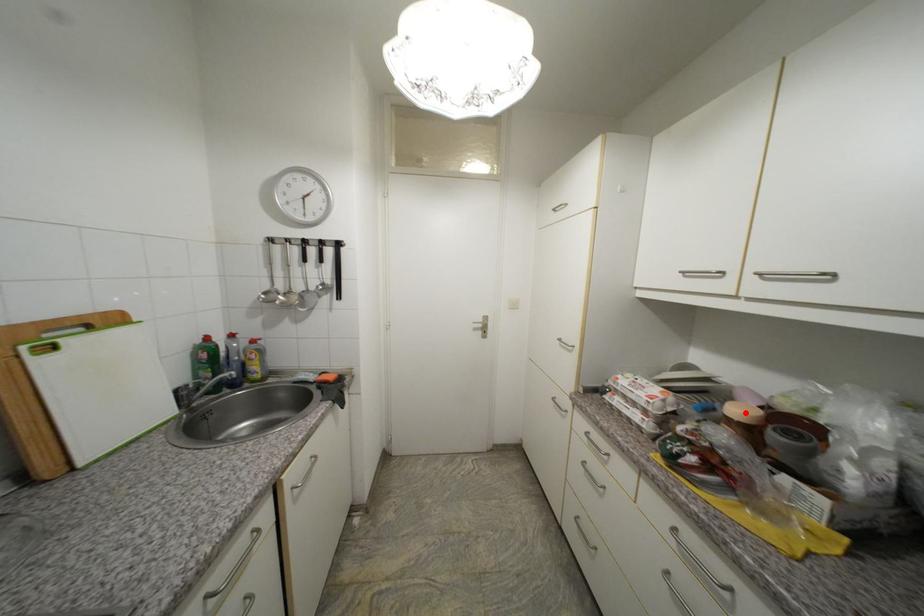
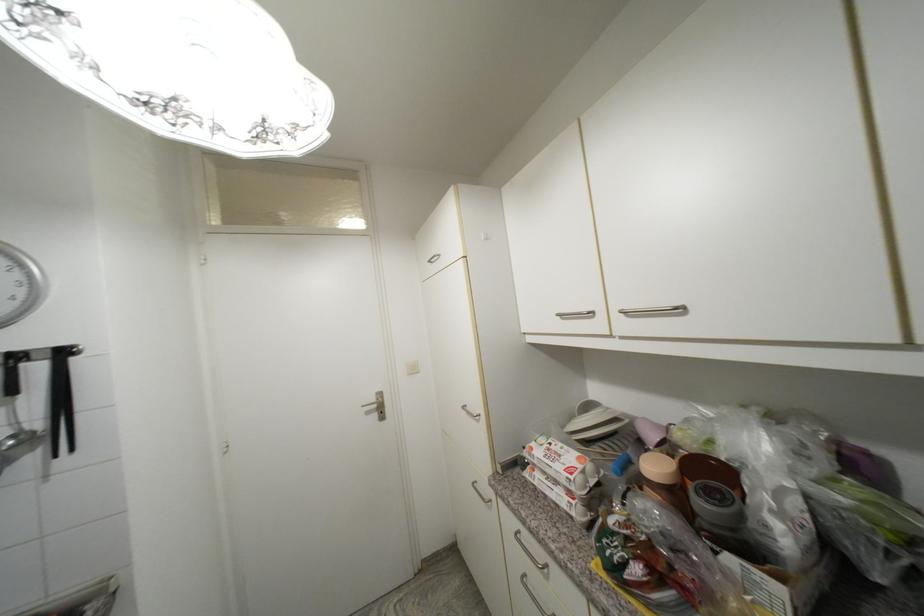
The point at the highlighted location is marked in the first image. Where is the corresponding point in the second image?

(662, 469)